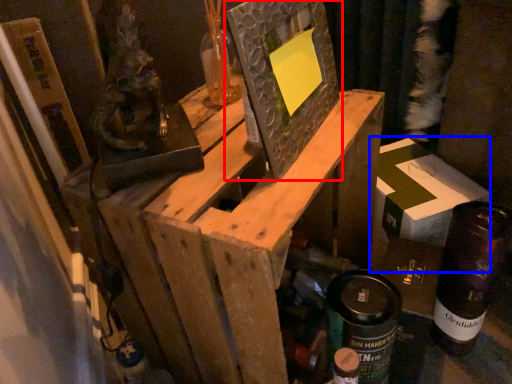
Question: Which point is closer to the camera, picture frame (highlighted by a red box) or cardboard box (highlighted by a blue box)?

Choices:
 (A) picture frame
 (B) cardboard box

Answer: (A)